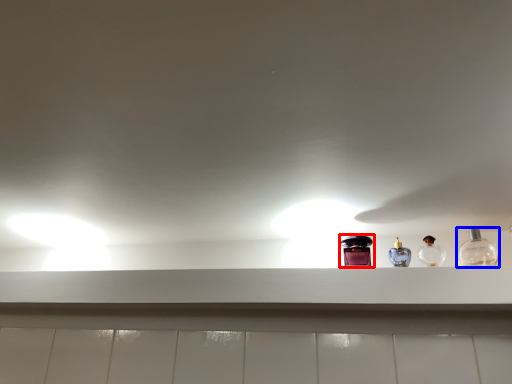
Question: Which object appears closest to the camera in this image, bottle (highlighted by a red box) or bottle (highlighted by a blue box)?

Choices:
 (A) bottle
 (B) bottle

Answer: (B)